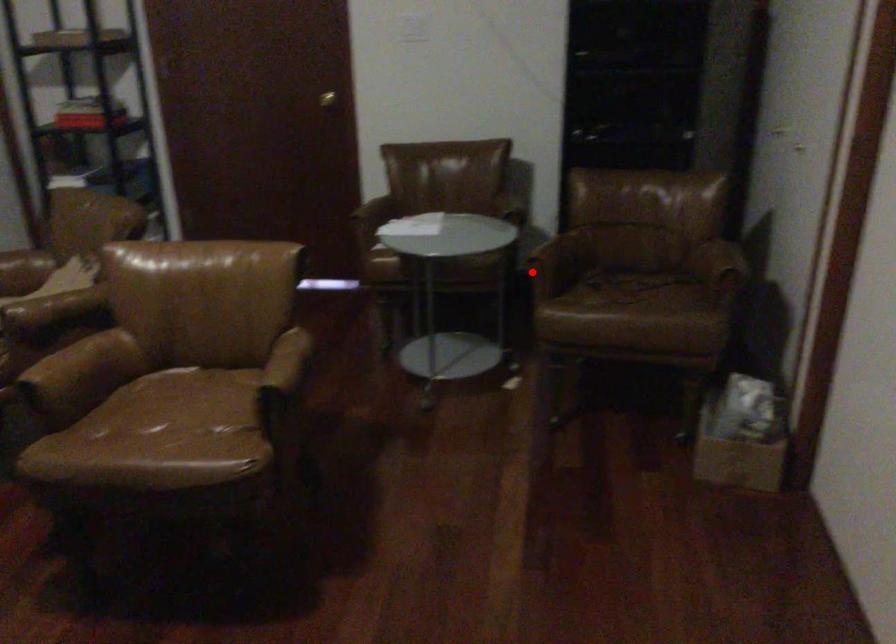
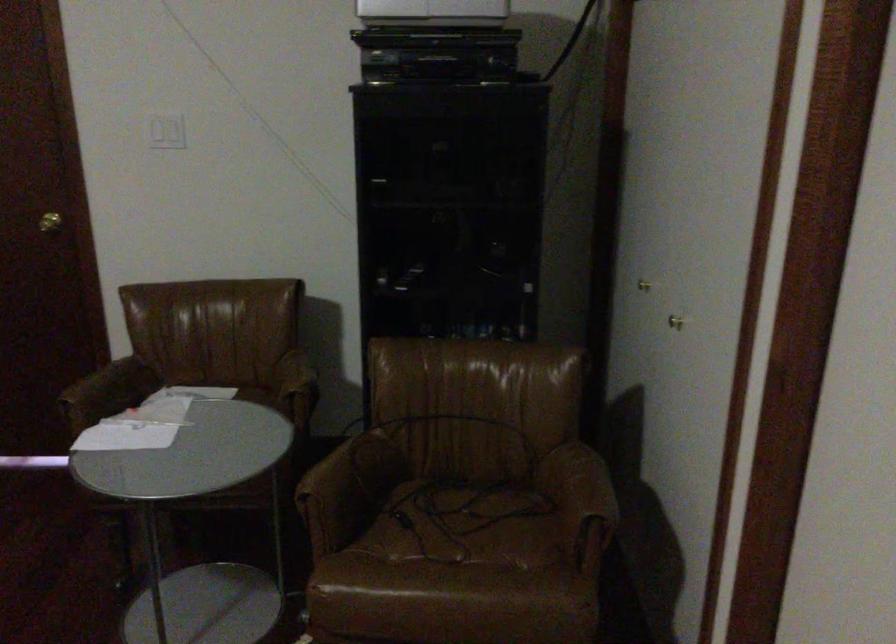
Question: I am providing you with two images of the same scene from different viewpoints. Image1 has a red point marked. In image2, the corresponding 3D location appears at what relative position? Reply with the corresponding letter.

Choices:
 (A) Closer
 (B) Farther

Answer: (A)